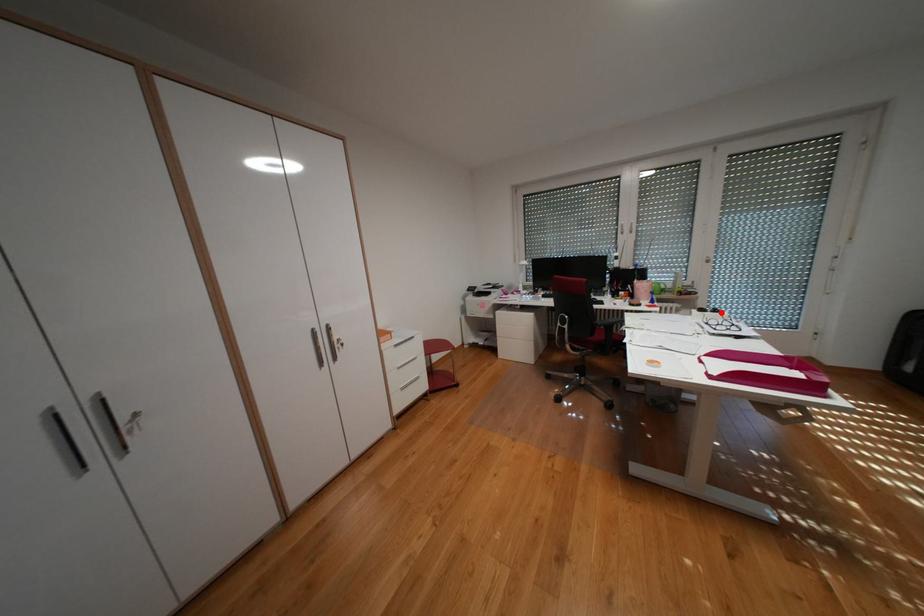
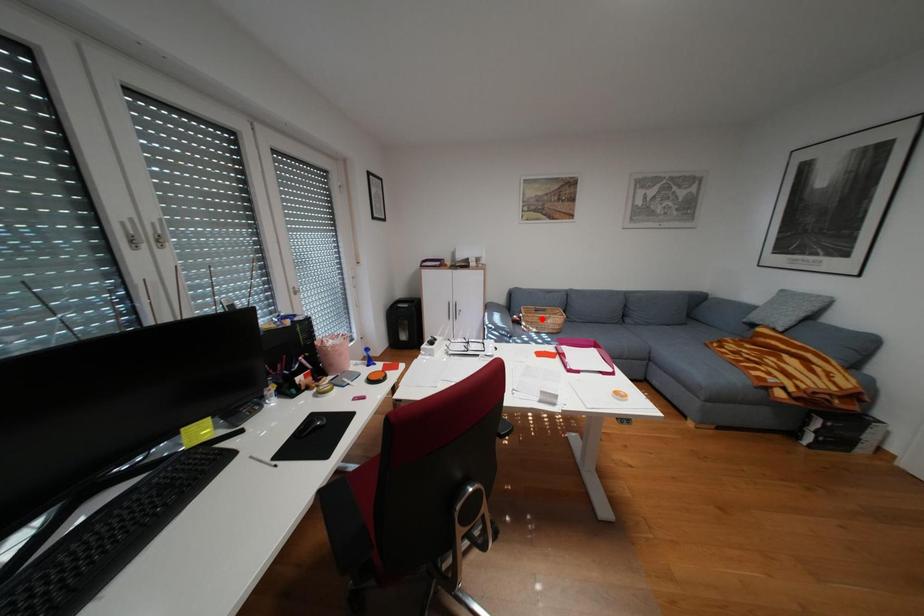
I am providing you with two images of the same scene from different viewpoints. A red point is marked on the first image and another point is marked on the second image. Are the points marked in image1 and image2 representing the same 3D position?

No